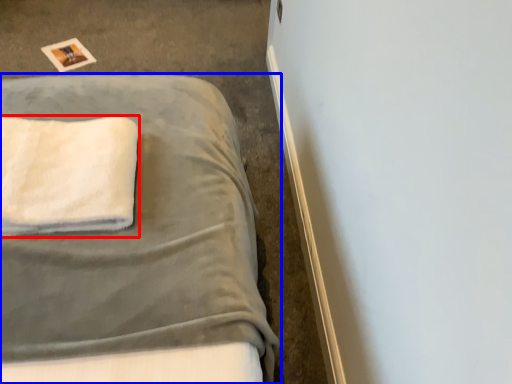
Question: Which object appears farthest to the camera in this image, towel (highlighted by a red box) or bed (highlighted by a blue box)?

Choices:
 (A) towel
 (B) bed

Answer: (B)